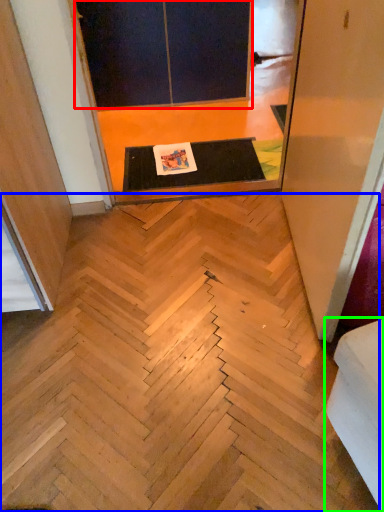
Question: Based on their relative distances, which object is nearer to screen door (highlighted by a red box)? Choose from stairwell (highlighted by a blue box) and furniture (highlighted by a green box).

Choices:
 (A) stairwell
 (B) furniture

Answer: (A)